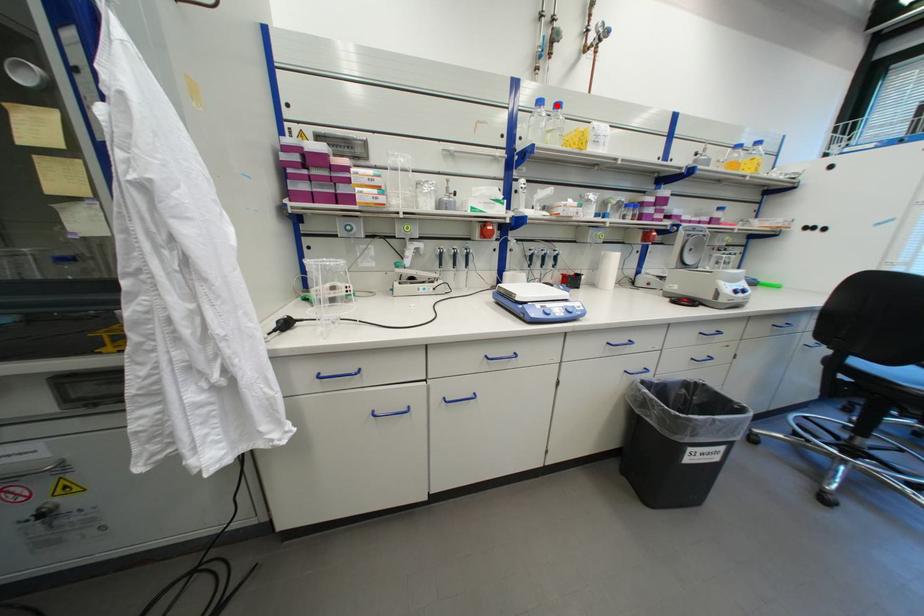
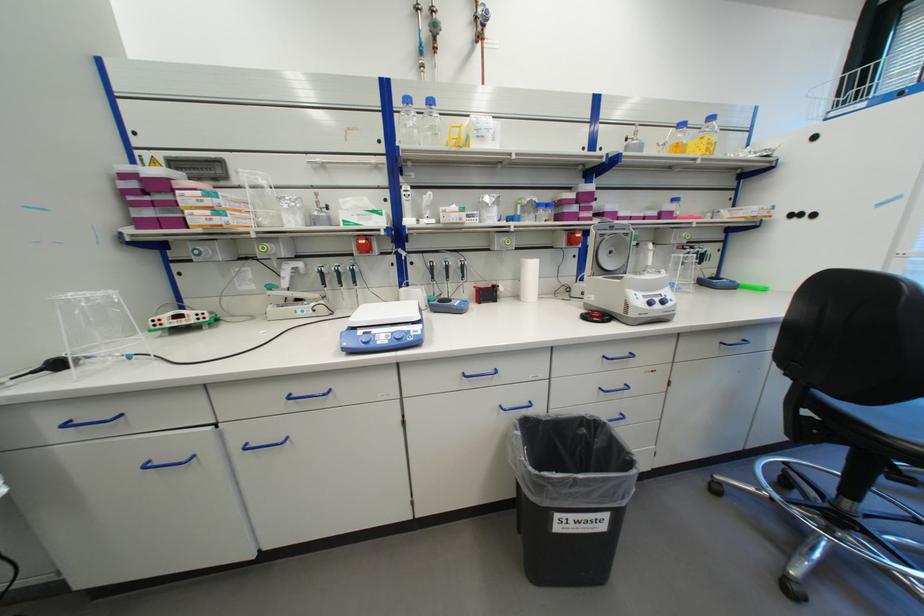
In the second image, find the point that corresponds to the highlighted location in the first image.

(428, 103)